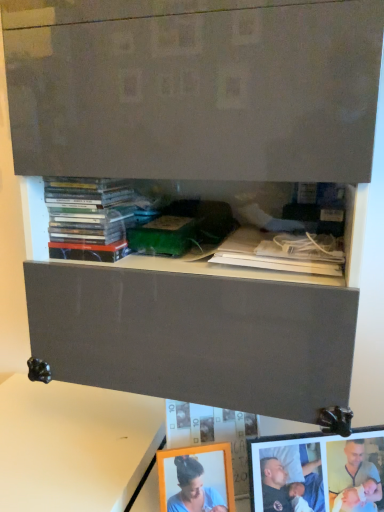
Question: Can you confirm if white paper at upper center, the second book from the left, is wider than matte plastic books at upper left, the first book viewed from the left?

Choices:
 (A) no
 (B) yes

Answer: (B)

Question: Is white paper at upper center, the second book from the left, at the left side of matte plastic books at upper left, which is the second book in right-to-left order?

Choices:
 (A) no
 (B) yes

Answer: (A)

Question: Is white paper at upper center, acting as the 1th book starting from the right, positioned beyond the bounds of matte plastic books at upper left, the first book viewed from the left?

Choices:
 (A) no
 (B) yes

Answer: (B)

Question: From the image's perspective, is white paper at upper center, the second book from the left, located above matte plastic books at upper left, the first book viewed from the left?

Choices:
 (A) no
 (B) yes

Answer: (A)

Question: Can you confirm if white paper at upper center, acting as the 1th book starting from the right, is shorter than matte plastic books at upper left, the first book viewed from the left?

Choices:
 (A) yes
 (B) no

Answer: (A)

Question: Are white paper at upper center, acting as the 1th book starting from the right, and matte plastic books at upper left, which is the second book in right-to-left order, located far from each other?

Choices:
 (A) yes
 (B) no

Answer: (B)

Question: From the image's perspective, does matte plastic books at upper left, the first book viewed from the left, appear higher than white matte table at lower left?

Choices:
 (A) yes
 (B) no

Answer: (A)

Question: Can you confirm if matte plastic books at upper left, which is the second book in right-to-left order, is smaller than white matte table at lower left?

Choices:
 (A) yes
 (B) no

Answer: (A)

Question: Is matte plastic books at upper left, the first book viewed from the left, taller than white matte table at lower left?

Choices:
 (A) no
 (B) yes

Answer: (A)

Question: Is matte plastic books at upper left, the first book viewed from the left, facing towards white matte table at lower left?

Choices:
 (A) yes
 (B) no

Answer: (B)

Question: Does matte plastic books at upper left, which is the second book in right-to-left order, touch white matte table at lower left?

Choices:
 (A) yes
 (B) no

Answer: (B)

Question: Is matte plastic books at upper left, the first book viewed from the left, at the right side of white matte table at lower left?

Choices:
 (A) no
 (B) yes

Answer: (B)

Question: Does white matte table at lower left appear on the left side of matte wooden picture frame at lower right?

Choices:
 (A) yes
 (B) no

Answer: (A)